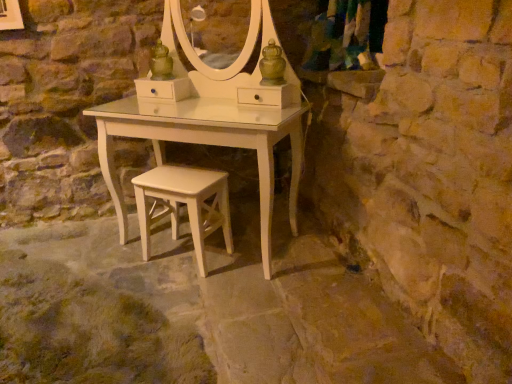
You are a GUI agent. You are given a task and a screenshot of the screen. Output one action in this format:
    pyautogui.click(x=<x>, y=<y>)
    Task: Click on the free spot in front of light beige wood stool at center
    This screenshot has height=384, width=512.
    Given the screenshot: What is the action you would take?
    pyautogui.click(x=192, y=292)